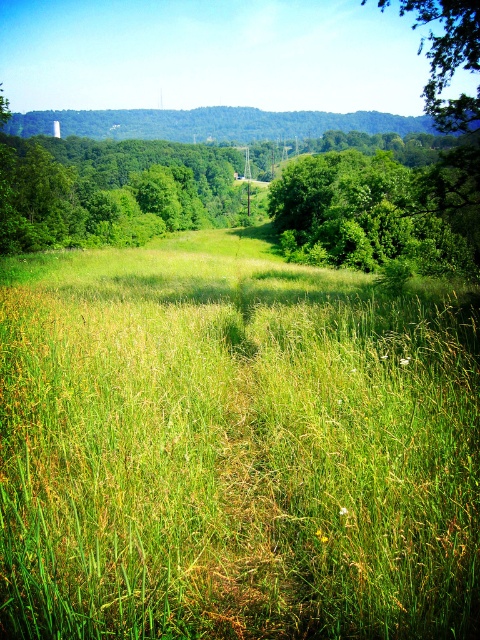
Question: Among these points, which one is nearest to the camera?

Choices:
 (A) (320, 608)
 (B) (373, 232)

Answer: (A)

Question: Is green grassy field at center above green leafy tree at center?

Choices:
 (A) no
 (B) yes

Answer: (A)

Question: Is green grassy field at center in front of green leafy tree at center?

Choices:
 (A) yes
 (B) no

Answer: (A)

Question: In this image, where is green grassy field at center located relative to green leafy tree at center?

Choices:
 (A) below
 (B) above

Answer: (A)

Question: Which point appears farthest from the camera in this image?

Choices:
 (A) (118, 611)
 (B) (282, 227)

Answer: (B)

Question: Which point appears closest to the camera in this image?

Choices:
 (A) (340, 518)
 (B) (374, 193)

Answer: (A)